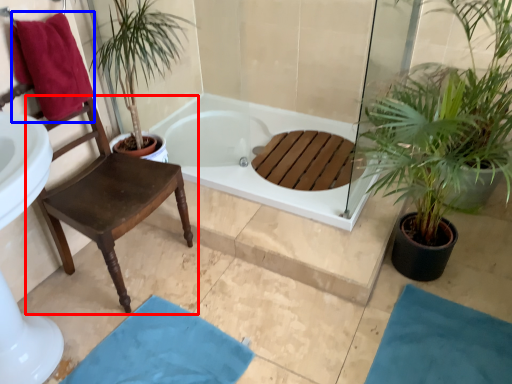
Question: Which of the following is the farthest to the observer, chair (highlighted by a red box) or beach towel (highlighted by a blue box)?

Choices:
 (A) chair
 (B) beach towel

Answer: (B)